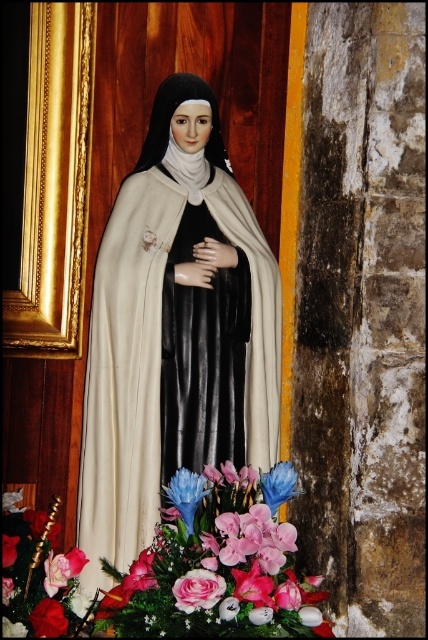
Question: Is white matte statue at center above blue silk flower at center?

Choices:
 (A) no
 (B) yes

Answer: (B)

Question: Can you confirm if white matte statue at center is wider than blue silk flower at center?

Choices:
 (A) no
 (B) yes

Answer: (B)

Question: Where is silky fabric bouquet at center located in relation to pink silk flower at lower left in the image?

Choices:
 (A) below
 (B) above

Answer: (A)

Question: Estimate the real-world distances between objects in this image. Which object is farther from the pink silk flower at lower left?

Choices:
 (A) blue matte flower at lower center
 (B) white matte statue at center

Answer: (B)

Question: Which of the following is the closest to the observer?

Choices:
 (A) (231, 220)
 (B) (186, 589)

Answer: (B)

Question: Considering the real-world distances, which object is farthest from the smooth red rose at lower left?

Choices:
 (A) blue silk flower at center
 (B) blue matte flower at lower center
 (C) white matte statue at center

Answer: (C)